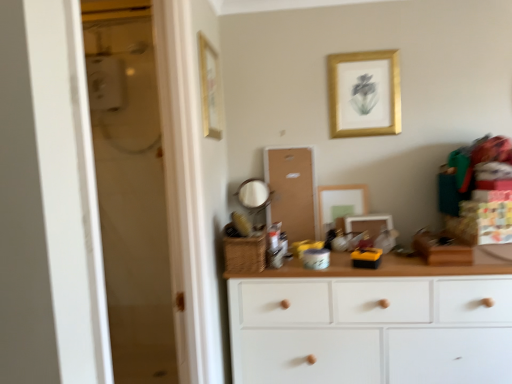
Question: Is point (359, 223) closer or farther from the camera than point (321, 206)?

Choices:
 (A) farther
 (B) closer

Answer: (B)

Question: Is matte white picture frame at center, positioned as the fourth picture frame in left-to-right order, wider or thinner than matte gold picture frame at center, the 2th picture frame when ordered from left to right?

Choices:
 (A) thin
 (B) wide

Answer: (B)

Question: Estimate the real-world distances between objects in this image. Which object is closer to the matte white picture frame at center, positioned as the fourth picture frame in left-to-right order?

Choices:
 (A) wooden picture frame at upper center, which appears as the fourth picture frame when viewed from the right
 (B) white wood chest of drawers at center
 (C) corkboard at center
 (D) matte gold picture frame at center, which appears as the 3th picture frame when viewed from the right
 (E) gold/golden frame at upper center, which is the second picture frame in right-to-left order

Answer: (D)

Question: Which of these objects is positioned closest to the corkboard at center?

Choices:
 (A) matte white picture frame at center, positioned as the fourth picture frame in left-to-right order
 (B) gold/golden frame at upper center, arranged as the third picture frame when viewed from the left
 (C) white wood chest of drawers at center
 (D) matte gold picture frame at center, the 2th picture frame when ordered from left to right
 (E) wooden picture frame at upper center, which appears as the fourth picture frame when viewed from the right

Answer: (D)